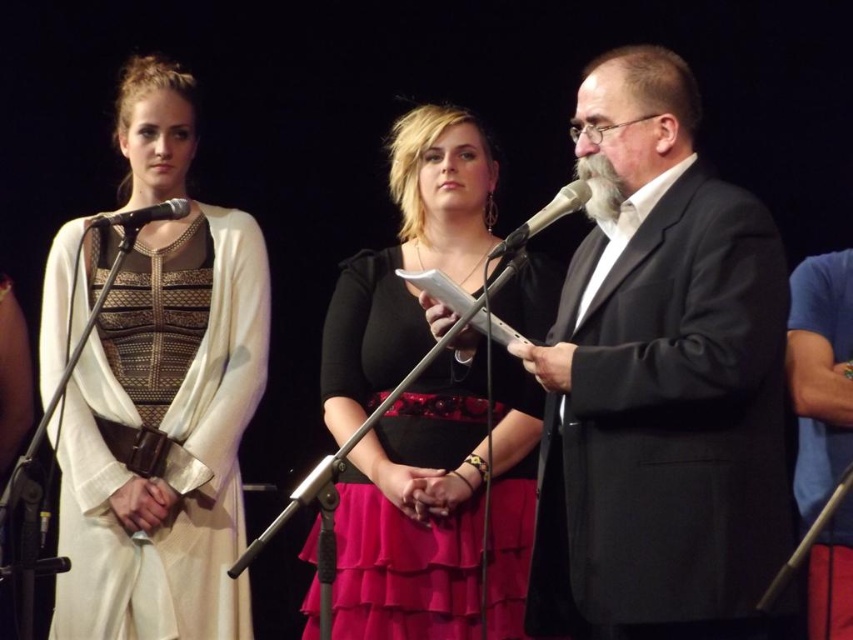
You are an event planner arranging the stage for a presentation. You need to ensure that the black satin dress at center is visible to the audience without being blocked by the metallic silver microphone at center. Based on their positions, is this possible?

The black satin dress at center is positioned under the metallic silver microphone at center, so it might be partially or fully blocked from the audience view depending on the angle and height. Adjust the microphone stand or position the dress further forward to ensure visibility.

You are an event planner trying to arrange a photo shoot for the ceremony. You need to ensure that the matte white dress at left and the metallic silver microphone at center are visible in the frame. Considering their sizes, which object should be placed closer to the camera to maintain their visibility?

The matte white dress at left is bigger than the metallic silver microphone at center, so to maintain visibility, the metallic silver microphone at center should be placed closer to the camera since it is smaller and needs to be emphasized.

You are an event planner setting up a stage for a presentation. You need to ensure that the black satin dress at center and the metallic silver microphone at center are visible to the audience. Based on their positions, which object will appear closer to the audience?

The black satin dress at center appears closer to the audience because it is further to the viewer than the metallic silver microphone at center.